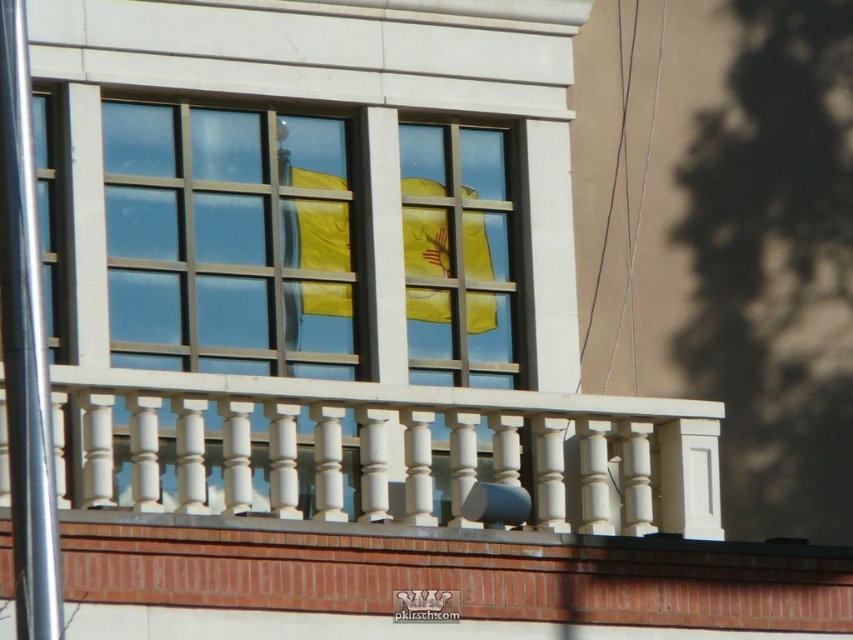
Does point (468, 464) come farther from viewer compared to point (30, 353)?

Yes, point (468, 464) is behind point (30, 353).

Does point (683, 536) lie behind point (7, 72)?

Yes, point (683, 536) is behind point (7, 72).

You are a GUI agent. You are given a task and a screenshot of the screen. Output one action in this format:
    pyautogui.click(x=<x>, y=<y>)
    Task: Click on the white painted wood balcony at center
    This screenshot has height=640, width=853.
    Given the screenshot: What is the action you would take?
    pyautogui.click(x=380, y=451)

Between white painted wood balcony at center and yellow matte flag at center, which one has more height?

white painted wood balcony at center

Is white painted wood balcony at center taller than yellow matte flag at center?

Yes, white painted wood balcony at center is taller than yellow matte flag at center.

I want to click on white painted wood balcony at center, so click(x=380, y=451).

Find the location of a particular element. The image size is (853, 640). white painted wood balcony at center is located at coordinates (380, 451).

Describe the element at coordinates (25, 348) in the screenshot. I see `polished silver pole at left` at that location.

Is polished silver pole at left taller than yellow matte flag at center?

No.

Where is `polished silver pole at left`? polished silver pole at left is located at coordinates (25, 348).

Locate an element on the screen. This screenshot has width=853, height=640. polished silver pole at left is located at coordinates (25, 348).